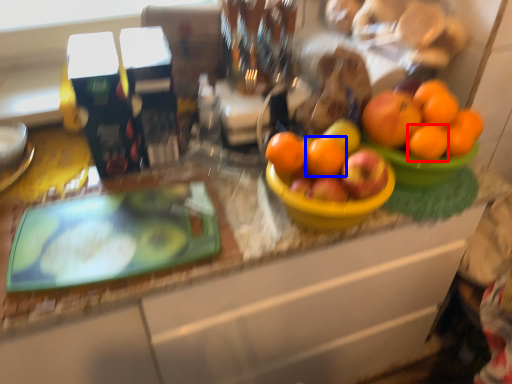
Question: Which object is further to the camera taking this photo, orange (highlighted by a red box) or orange (highlighted by a blue box)?

Choices:
 (A) orange
 (B) orange

Answer: (A)